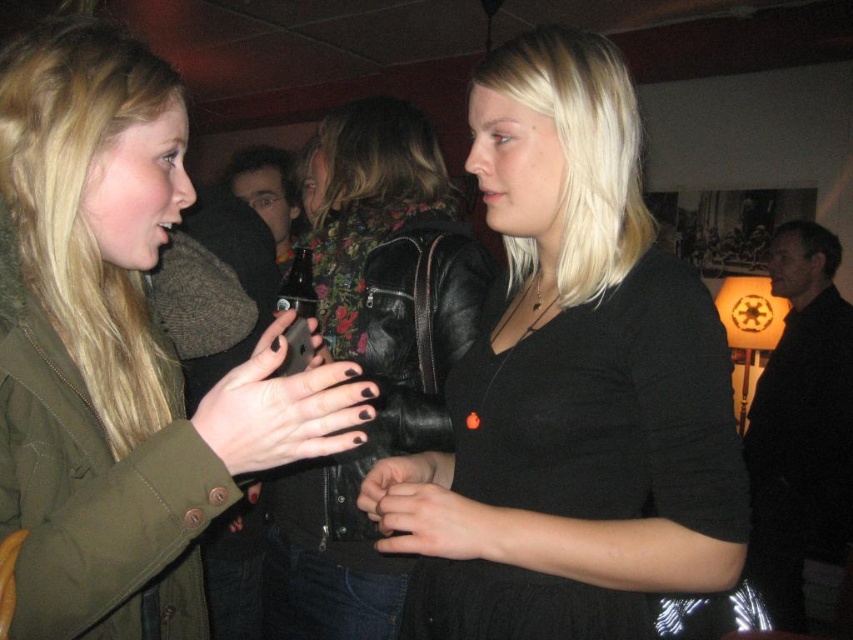
Is black matte phone at center thinner than smooth black hand at center?

Yes, black matte phone at center is thinner than smooth black hand at center.

Does black matte phone at center have a greater width compared to smooth black hand at center?

Incorrect, black matte phone at center's width does not surpass smooth black hand at center's.

Is point (236, 417) closer to camera compared to point (393, 529)?

Yes, it is.

You are a GUI agent. You are given a task and a screenshot of the screen. Output one action in this format:
    pyautogui.click(x=<x>, y=<y>)
    Task: Click on the black matte phone at center
    
    Given the screenshot: What is the action you would take?
    pyautogui.click(x=283, y=406)

Which is behind, point (289, 321) or point (369, 502)?

Point (369, 502)

Is black matte phone at center to the left of matte black hands at center from the viewer's perspective?

Indeed, black matte phone at center is positioned on the left side of matte black hands at center.

Is point (281, 358) more distant than point (389, 531)?

No, (281, 358) is in front of (389, 531).

What are the coordinates of `black matte phone at center` in the screenshot? It's located at 283,406.

Is black matte shirt at center smaller than matte black hands at center?

No, black matte shirt at center is not smaller than matte black hands at center.

Who is positioned more to the left, black matte shirt at center or matte black hands at center?

From the viewer's perspective, matte black hands at center appears more on the left side.

Locate an element on the screen. The width and height of the screenshot is (853, 640). black matte shirt at center is located at coordinates (583, 372).